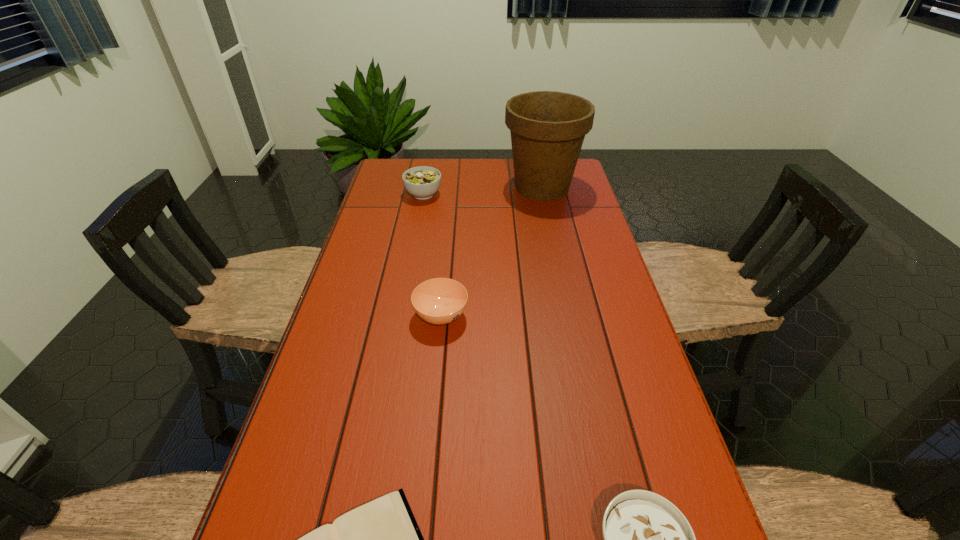
Identify the location of object that is at the far left corner. This screenshot has width=960, height=540. (422, 182).

Identify the location of object located at the far right corner. The height and width of the screenshot is (540, 960). (547, 128).

In order to click on vacant area at the far edge of the desktop in this screenshot , I will do `click(502, 159)`.

In the image, there is a desktop. Find the location of `vacant region at the left edge`. vacant region at the left edge is located at coordinates (362, 291).

In the image, there is a desktop. Identify the location of free region at the right edge. This screenshot has width=960, height=540. (626, 325).

The image size is (960, 540). In order to click on vacant area that lies between the farthest soup bowl and the third farthest object in this screenshot , I will do `click(432, 255)`.

Locate an element on the screen. This screenshot has height=540, width=960. free space between the farthest soup bowl and the second farthest soup bowl is located at coordinates (432, 255).

Locate an element on the screen. Image resolution: width=960 pixels, height=540 pixels. free space between the flowerpot and the second nearest soup bowl is located at coordinates (492, 252).

Identify which object is the fourth closest to the nearest soup bowl. Please provide its 2D coordinates. Your answer should be formatted as a tuple, i.e. [(x, y)], where the tuple contains the x and y coordinates of a point satisfying the conditions above.

[(422, 182)]

Find the location of `object that is the third closest to the tallest object`. object that is the third closest to the tallest object is located at coordinates click(381, 539).